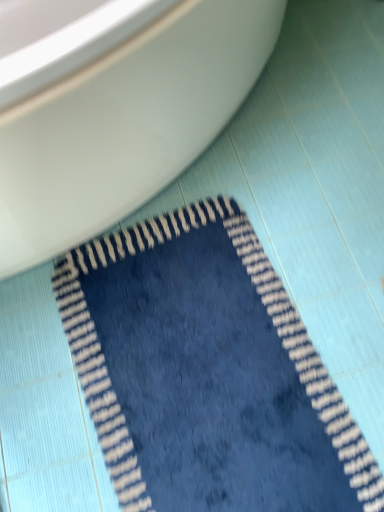
Question: Does point (72, 202) appear closer or farther from the camera than point (380, 500)?

Choices:
 (A) farther
 (B) closer

Answer: (A)

Question: In terms of height, does white glossy toilet at upper left look taller or shorter compared to navy blue plush rug at lower center?

Choices:
 (A) short
 (B) tall

Answer: (B)

Question: Relative to navy blue plush rug at lower center, is white glossy toilet at upper left in front or behind?

Choices:
 (A) front
 (B) behind

Answer: (A)

Question: From a real-world perspective, is navy blue plush rug at lower center physically located above or below white glossy toilet at upper left?

Choices:
 (A) below
 (B) above

Answer: (A)

Question: Looking at the image, does navy blue plush rug at lower center seem bigger or smaller compared to white glossy toilet at upper left?

Choices:
 (A) small
 (B) big

Answer: (A)

Question: Considering the relative positions of navy blue plush rug at lower center and white glossy toilet at upper left in the image provided, is navy blue plush rug at lower center to the left or to the right of white glossy toilet at upper left?

Choices:
 (A) right
 (B) left

Answer: (A)

Question: From their relative heights in the image, would you say navy blue plush rug at lower center is taller or shorter than white glossy toilet at upper left?

Choices:
 (A) tall
 (B) short

Answer: (B)